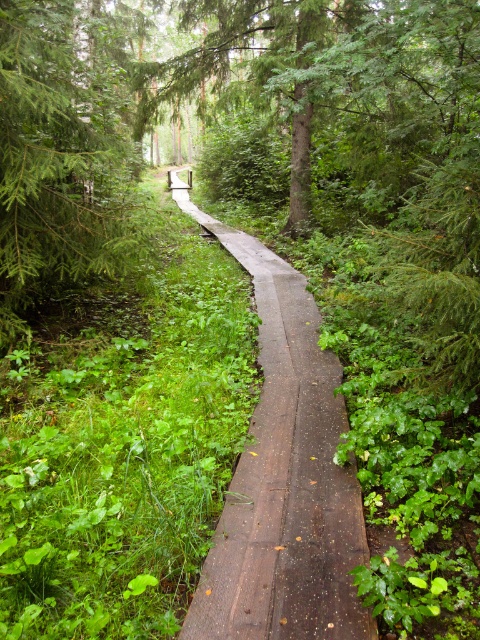
Question: Does brown wooden path at center lie behind green matte tree at upper left?

Choices:
 (A) yes
 (B) no

Answer: (B)

Question: Does brown wooden path at center have a smaller size compared to green matte tree at upper left?

Choices:
 (A) no
 (B) yes

Answer: (B)

Question: Does brown wooden path at center appear under green matte tree at upper left?

Choices:
 (A) yes
 (B) no

Answer: (A)

Question: Which point is farther to the camera?

Choices:
 (A) brown wooden path at center
 (B) green matte tree at upper left

Answer: (B)